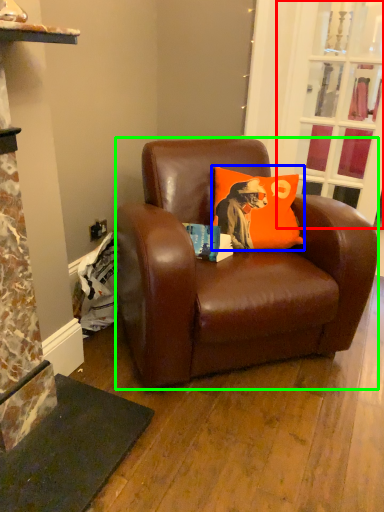
Question: Which object is the closest to the glass door (highlighted by a red box)? Choose among these: pillow (highlighted by a blue box) or studio couch (highlighted by a green box).

Choices:
 (A) pillow
 (B) studio couch

Answer: (A)